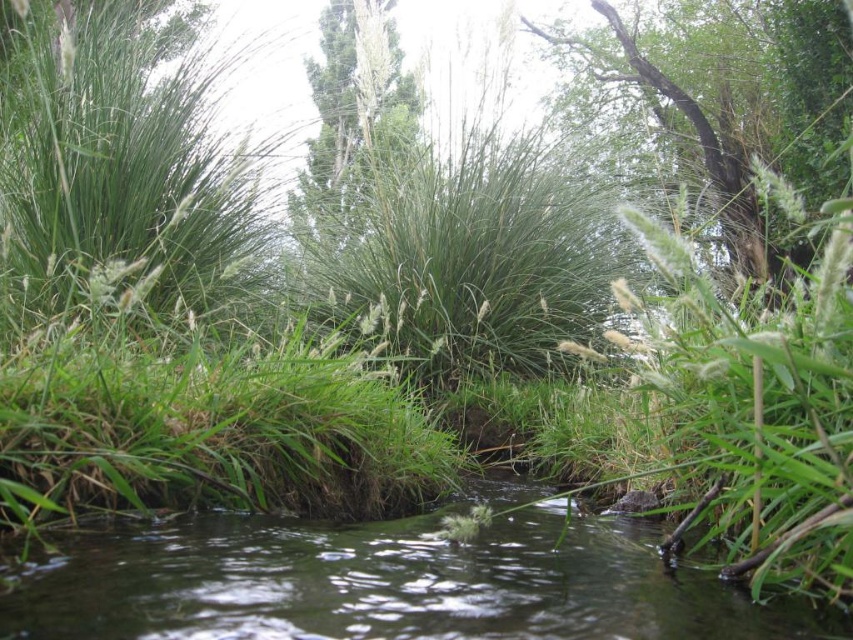
Based on the scene described, which object, the green grassy plant at upper center or the green rough bark tree at upper center, would cast a longer shadow if the sun were directly overhead?

The green grassy plant at upper center is larger in size than the green rough bark tree at upper center, so it would cast a longer shadow when the sun is directly overhead.

You are standing at the edge of the water body in the scene. You notice two points marked in the image. Which of the two points, point (x=165, y=582) or point (x=672, y=84), is closer to your current position?

Point (x=165, y=582) is closer to the camera than point (x=672, y=84), so it is closer to your current position.

In the scene shown: Based on the coordinates provided in the scene description, where is the green grassy river at center located?

The green grassy river at center is located at point [387,584].